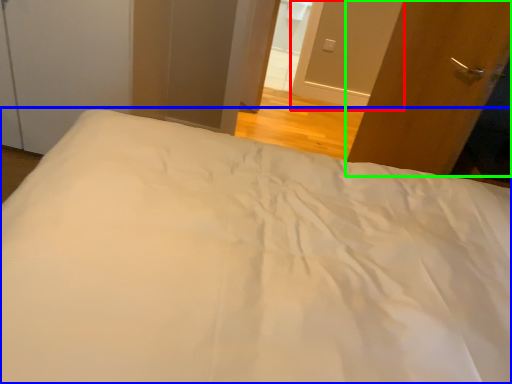
Question: Considering the real-world distances, which object is farthest from screen door (highlighted by a red box)? bed (highlighted by a blue box) or door (highlighted by a green box)?

Choices:
 (A) bed
 (B) door

Answer: (A)